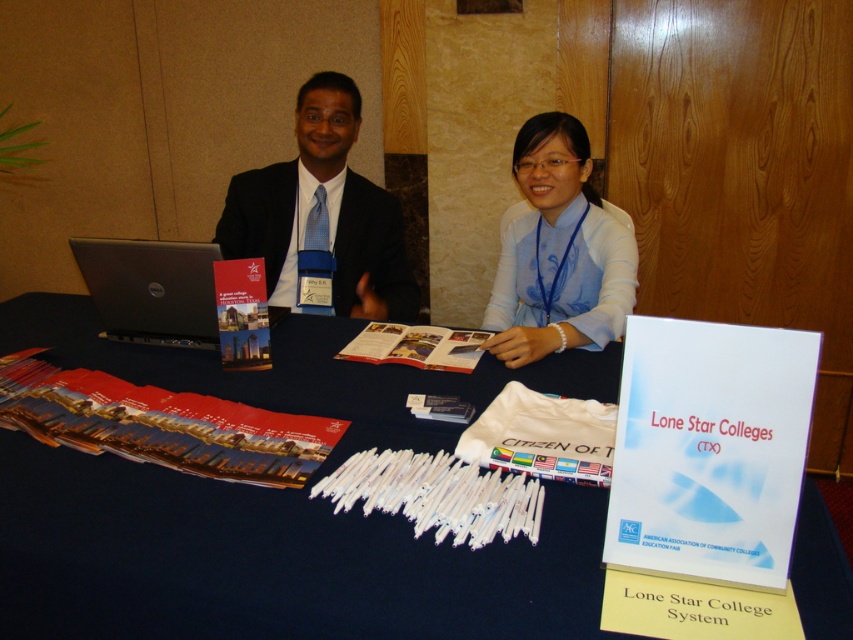
Between blue fabric table at center and matte black suit at center, which one has more height?

With more height is matte black suit at center.

Which is in front, point (67, 531) or point (282, 211)?

Positioned in front is point (67, 531).

The width and height of the screenshot is (853, 640). I want to click on blue fabric table at center, so click(x=277, y=508).

Does blue fabric table at center have a smaller size compared to silver metallic laptop at center?

Actually, blue fabric table at center might be larger than silver metallic laptop at center.

Is point (177, 588) farther from viewer compared to point (154, 340)?

No, it is not.

Between point (196, 604) and point (167, 266), which one is positioned in front?

Point (196, 604)

Find the location of a particular element. The width and height of the screenshot is (853, 640). blue fabric table at center is located at coordinates (277, 508).

Is blue fabric shirt at center closer to the viewer compared to matte black suit at center?

No, it is not.

Does point (302, 150) lie in front of point (338, 74)?

No, (302, 150) is behind (338, 74).

You are a GUI agent. You are given a task and a screenshot of the screen. Output one action in this format:
    pyautogui.click(x=<x>, y=<y>)
    Task: Click on the blue fabric shirt at center
    Image resolution: width=853 pixels, height=640 pixels.
    Given the screenshot: What is the action you would take?
    click(370, 253)

Locate an element on the screen. The image size is (853, 640). blue fabric shirt at center is located at coordinates (370, 253).